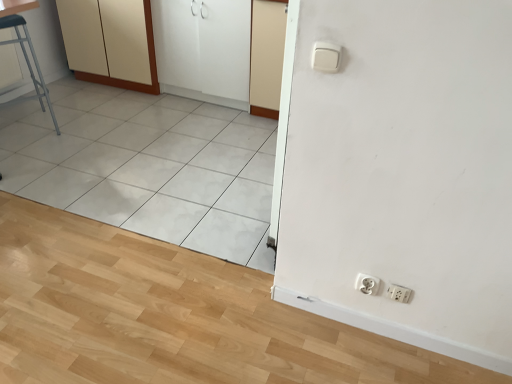
Question: Considering their positions, is metallic stool at left located in front of or behind white matte screen door at upper center, which ranks as the second screen door in left-to-right order?

Choices:
 (A) front
 (B) behind

Answer: (A)

Question: Is point (13, 39) closer or farther from the camera than point (261, 8)?

Choices:
 (A) closer
 (B) farther

Answer: (B)

Question: Considering the real-world distances, which object is farthest from the matte cream cabinet at upper left?

Choices:
 (A) white matte screen door at upper center, which ranks as the second screen door in left-to-right order
 (B) white plastic socket at lower right, which is counted as the first socket, starting from the left
 (C) white glossy cabinet at upper left, which is counted as the 2th screen door, starting from the right
 (D) metallic stool at left
 (E) white plastic socket at lower right, placed as the first socket when sorted from right to left

Answer: (E)

Question: Which of these objects is positioned farthest from the white matte screen door at upper center, which ranks as the second screen door in left-to-right order?

Choices:
 (A) matte cream cabinet at upper left
 (B) white plastic socket at lower right, which is counted as the second socket, starting from the right
 (C) metallic stool at left
 (D) white plastic socket at lower right, which ranks as the second socket in left-to-right order
 (E) white glossy cabinet at upper left, which is counted as the 2th screen door, starting from the right

Answer: (D)